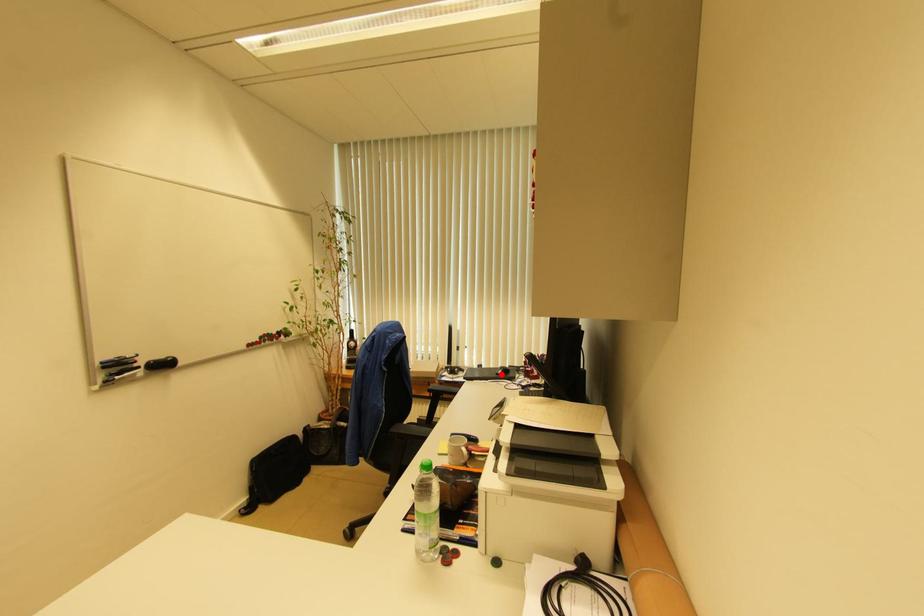
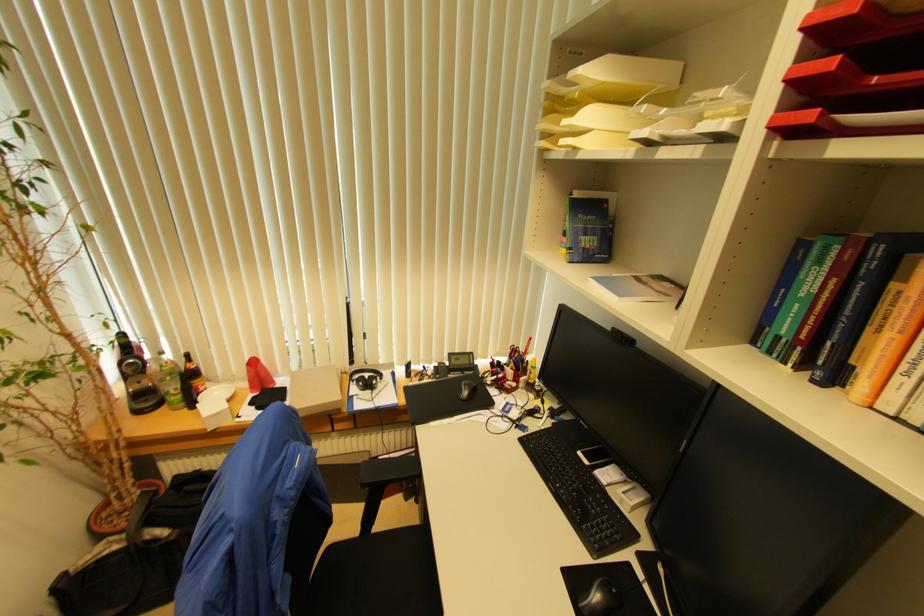
In the second image, find the point that corresponds to the highlighted location in the first image.

(467, 395)